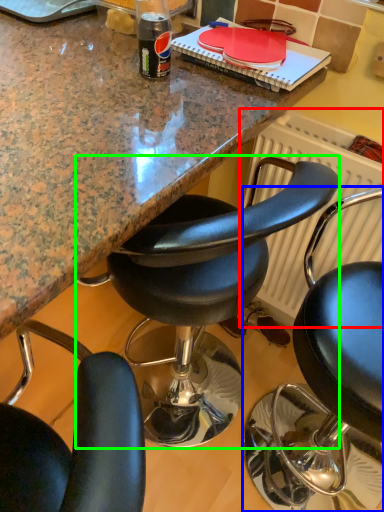
Question: Which is farther away from radiator (highlighted by a red box)? chair (highlighted by a blue box) or chair (highlighted by a green box)?

Choices:
 (A) chair
 (B) chair

Answer: (A)